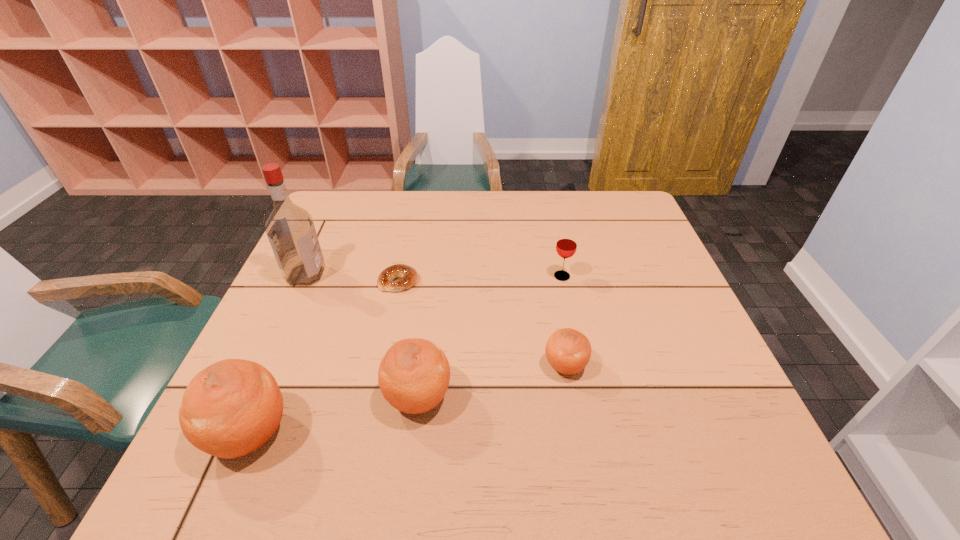
In the image, there is a desktop. At what (x,y) coordinates should I click in order to perform the action: click on vacant region at the far left corner. Please return your answer as a coordinate pair (x, y). Looking at the image, I should click on (360, 222).

Find the location of a particular element. free space at the far right corner of the desktop is located at coordinates (630, 206).

Where is `free region at the near right corner`? free region at the near right corner is located at coordinates (688, 430).

Image resolution: width=960 pixels, height=540 pixels. Find the location of `empty space that is in between the glass and the fifth tallest object`. empty space that is in between the glass and the fifth tallest object is located at coordinates (564, 321).

The height and width of the screenshot is (540, 960). I want to click on vacant area between the tallest object and the glass, so click(434, 275).

Where is `vacant region between the glass and the tallest object`? vacant region between the glass and the tallest object is located at coordinates (434, 275).

This screenshot has height=540, width=960. Identify the location of vacant region between the glass and the second tallest orange. (490, 337).

This screenshot has width=960, height=540. Find the location of `vacant space in between the glass and the shortest orange`. vacant space in between the glass and the shortest orange is located at coordinates (564, 321).

The height and width of the screenshot is (540, 960). What are the coordinates of `unoccupied area between the tallest object and the leftmost orange` in the screenshot? It's located at (278, 355).

I want to click on free point between the shortest object and the glass, so click(x=480, y=279).